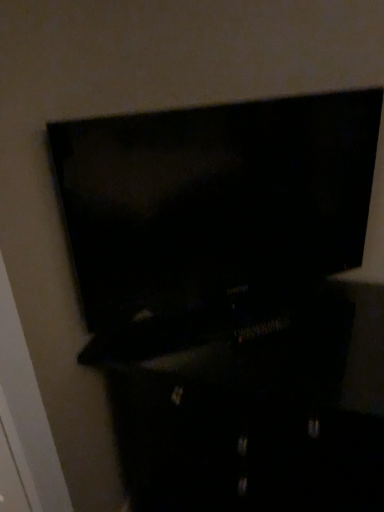
This screenshot has width=384, height=512. Identify the location of black glossy dresser at center. (216, 390).

This screenshot has width=384, height=512. Describe the element at coordinates (216, 390) in the screenshot. I see `black glossy dresser at center` at that location.

The height and width of the screenshot is (512, 384). What do you see at coordinates (232, 300) in the screenshot?
I see `matte black tv at upper center` at bounding box center [232, 300].

Identify the location of matte black tv at upper center. (232, 300).

The height and width of the screenshot is (512, 384). What are the coordinates of `black glossy dresser at center` in the screenshot? It's located at pos(216,390).

Which is more to the left, black glossy dresser at center or matte black tv at upper center?

matte black tv at upper center.

Is black glossy dresser at center closer to camera compared to matte black tv at upper center?

No, black glossy dresser at center is further to the viewer.

Does point (187, 455) come behind point (360, 459)?

Yes.

From the image's perspective, who appears lower, black glossy dresser at center or matte black tv at upper center?

From the image's view, black glossy dresser at center is below.

From a real-world perspective, does black glossy dresser at center stand above matte black tv at upper center?

Actually, black glossy dresser at center is physically below matte black tv at upper center in the real world.

Is black glossy dresser at center wider or thinner than matte black tv at upper center?

In the image, black glossy dresser at center appears to be wider than matte black tv at upper center.

Who is shorter, black glossy dresser at center or matte black tv at upper center?

matte black tv at upper center is shorter.

From the picture: Between black glossy dresser at center and matte black tv at upper center, which one has larger size?

black glossy dresser at center is bigger.

Is black glossy dresser at center spatially inside matte black tv at upper center, or outside of it?

black glossy dresser at center exists outside the volume of matte black tv at upper center.

From the picture: Is black glossy dresser at center with matte black tv at upper center?

Yes.

Is black glossy dresser at center facing towards matte black tv at upper center?

No.

Where is `dresser below the matte black tv at upper center (from a real-world perspective)`? dresser below the matte black tv at upper center (from a real-world perspective) is located at coordinates (216, 390).

Between matte black tv at upper center and black glossy dresser at center, which one appears on the right side from the viewer's perspective?

black glossy dresser at center is more to the right.

Which object is further away from the camera, matte black tv at upper center or black glossy dresser at center?

black glossy dresser at center.

Which is closer, (247, 110) or (229, 467)?

The point (247, 110) is in front.

From the image's perspective, does matte black tv at upper center appear lower than black glossy dresser at center?

Incorrect, from the image's perspective, matte black tv at upper center is higher than black glossy dresser at center.

From a real-world perspective, which is physically above, matte black tv at upper center or black glossy dresser at center?

matte black tv at upper center.

Looking at this image, between matte black tv at upper center and black glossy dresser at center, which one has larger width?

→ black glossy dresser at center.

Which of these two, matte black tv at upper center or black glossy dresser at center, stands shorter?

Standing shorter between the two is matte black tv at upper center.

In terms of size, does matte black tv at upper center appear bigger or smaller than black glossy dresser at center?

matte black tv at upper center is smaller than black glossy dresser at center.

Is matte black tv at upper center completely or partially outside of black glossy dresser at center?

matte black tv at upper center is positioned outside black glossy dresser at center.

Can you see matte black tv at upper center touching black glossy dresser at center?

Yes, the surface of matte black tv at upper center is in contact with black glossy dresser at center.

Is black glossy dresser at center at the back of matte black tv at upper center?

matte black tv at upper center is not turned away from black glossy dresser at center.

How different are the orientations of matte black tv at upper center and black glossy dresser at center in degrees?

37.9 degrees separate the facing orientations of matte black tv at upper center and black glossy dresser at center.

How far apart are matte black tv at upper center and black glossy dresser at center?

matte black tv at upper center and black glossy dresser at center are 9.12 centimeters apart.

The image size is (384, 512). Identify the location of dresser below the matte black tv at upper center (from a real-world perspective). (216, 390).

You are a GUI agent. You are given a task and a screenshot of the screen. Output one action in this format:
    pyautogui.click(x=<x>, y=<y>)
    Task: Click on the dresser lying behind the matte black tv at upper center
    This screenshot has width=384, height=512.
    Given the screenshot: What is the action you would take?
    pyautogui.click(x=216, y=390)

Locate an element on the screen. dresser below the matte black tv at upper center (from the image's perspective) is located at coordinates (216, 390).